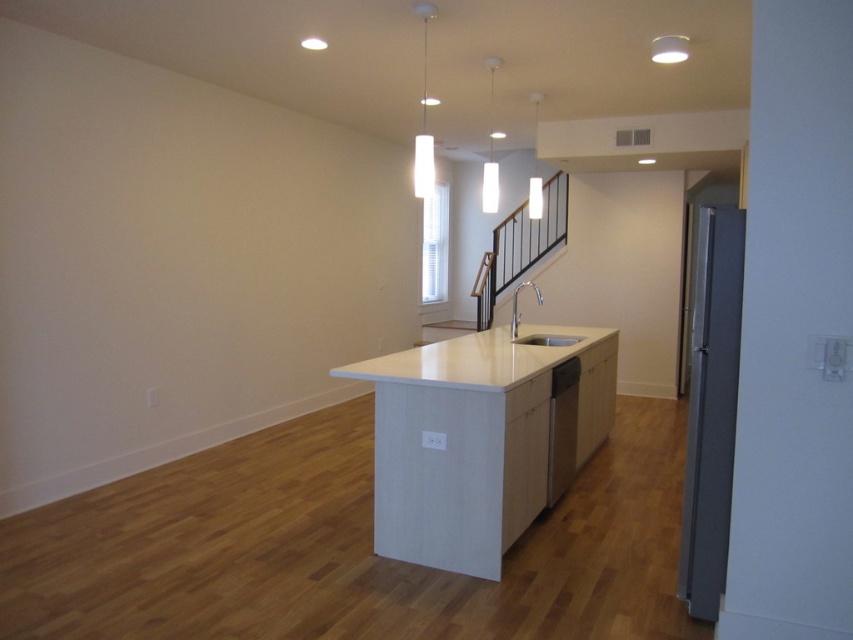
Question: Is white glossy countertop at center below white matte dishwasher at center?

Choices:
 (A) yes
 (B) no

Answer: (B)

Question: Is white glossy countertop at center wider than white glossy sink at center?

Choices:
 (A) no
 (B) yes

Answer: (B)

Question: Among these points, which one is nearest to the camera?

Choices:
 (A) (538, 508)
 (B) (566, 337)

Answer: (A)

Question: Is white laminate counter top at center wider than white glossy countertop at center?

Choices:
 (A) yes
 (B) no

Answer: (B)

Question: Which point is farther to the camera?

Choices:
 (A) white matte dishwasher at center
 (B) white laminate counter top at center

Answer: (A)

Question: Which point is closer to the camera?

Choices:
 (A) (577, 340)
 (B) (424, 458)
 (C) (479, 387)

Answer: (C)